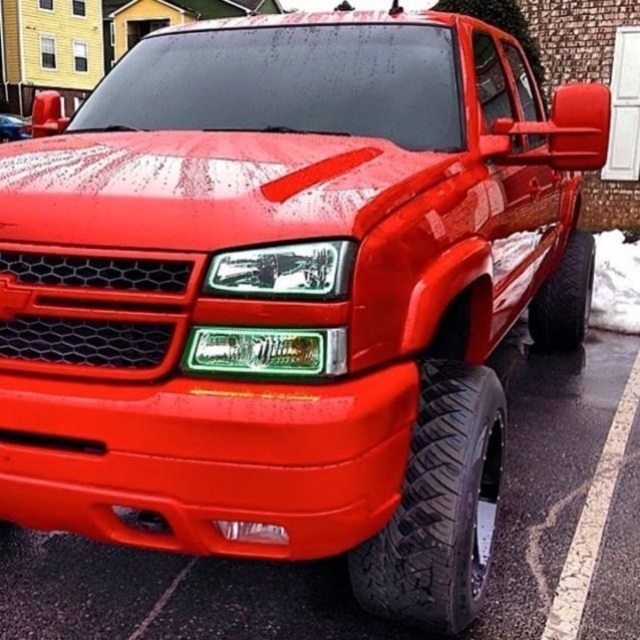
Question: Can you confirm if black rubber tire at right is positioned above transparent plastic license plate at lower center?

Choices:
 (A) yes
 (B) no

Answer: (A)

Question: Can you confirm if black rubber tire at right is smaller than transparent plastic license plate at lower center?

Choices:
 (A) no
 (B) yes

Answer: (A)

Question: Which object is the farthest from the transparent plastic license plate at lower center?

Choices:
 (A) glossy red truck at center
 (B) black rubber tire at lower right
 (C) black rubber tire at right

Answer: (A)

Question: Which object is positioned closest to the glossy red truck at center?

Choices:
 (A) black rubber tire at right
 (B) transparent plastic license plate at lower center

Answer: (A)

Question: In this image, where is black rubber tire at lower right located relative to glossy red truck at center?

Choices:
 (A) right
 (B) left

Answer: (A)

Question: Which of the following is the closest to the observer?

Choices:
 (A) glossy red truck at center
 (B) black rubber tire at lower right

Answer: (B)